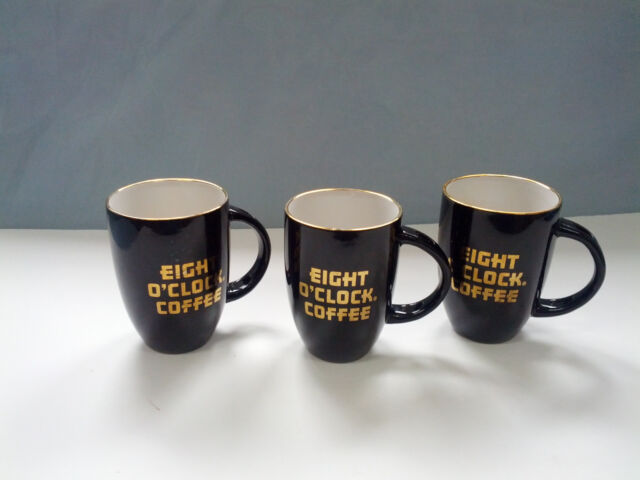
The width and height of the screenshot is (640, 480). I want to click on golden rim of mug, so pos(163,221), pos(340,233), pos(508,214).